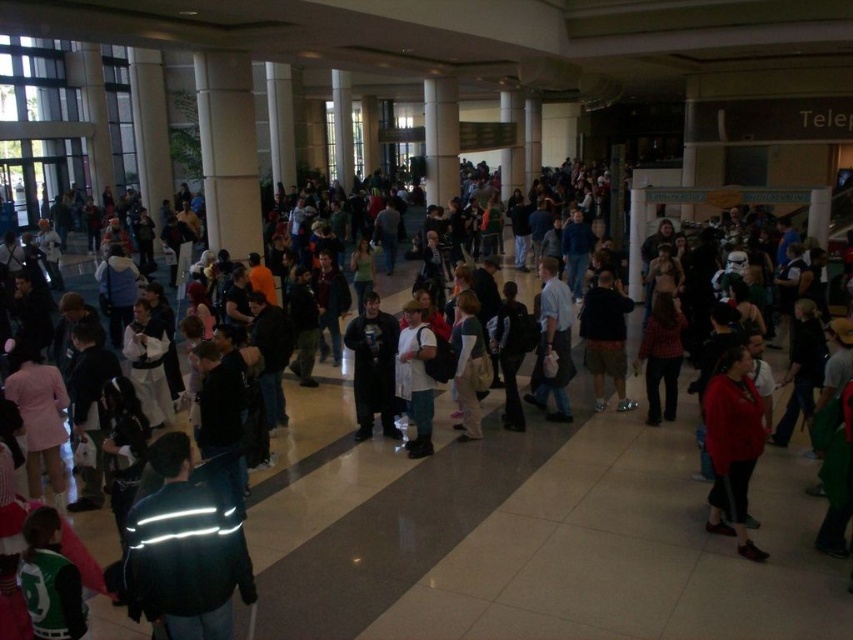
Question: Is matte red sweater at right thinner than black matte coat at center?

Choices:
 (A) no
 (B) yes

Answer: (B)

Question: Among these points, which one is nearest to the camera?

Choices:
 (A) (741, 499)
 (B) (619, 342)
 (C) (166, 502)

Answer: (C)

Question: Can you confirm if reflective green jacket at center is positioned to the left of light blue shirt at center?

Choices:
 (A) no
 (B) yes

Answer: (B)

Question: Which is nearer to the white cotton shirt at center?

Choices:
 (A) matte red sweater at right
 (B) light brown leather jacket at center
 (C) plaid shirt at center

Answer: (B)

Question: Can you confirm if light blue shirt at center is wider than plaid shirt at center?

Choices:
 (A) no
 (B) yes

Answer: (A)

Question: Which object is closer to the camera taking this photo?

Choices:
 (A) plaid shirt at center
 (B) matte red sweater at right
 (C) light brown leather jacket at center
 (D) white cotton shirt at center

Answer: (B)